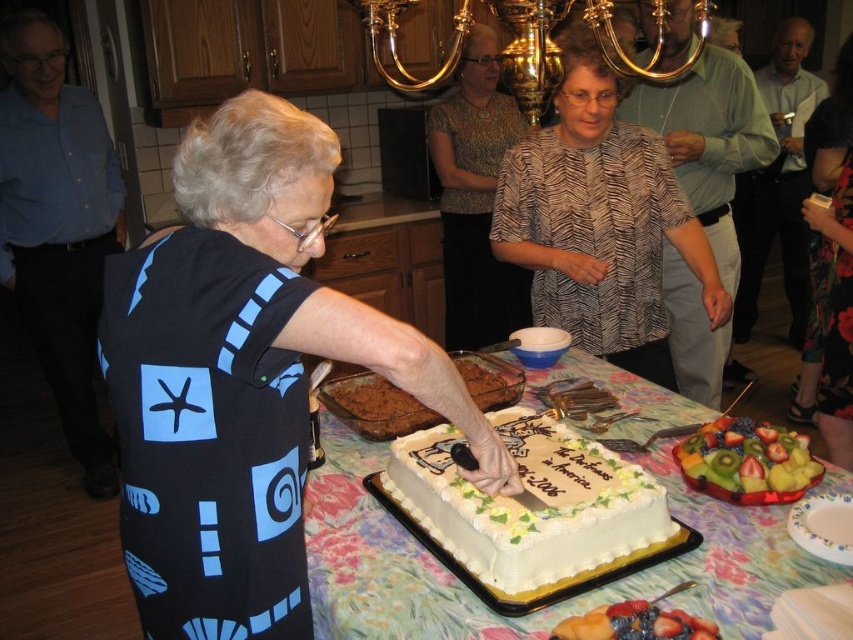
Between point (445, 612) and point (813, 536), which one is positioned behind?

Point (813, 536)

Does point (614, 582) come farther from viewer compared to point (820, 525)?

No, (614, 582) is closer to viewer.

Does point (392, 620) come behind point (817, 513)?

No, it is in front of (817, 513).

Locate an element on the screen. The image size is (853, 640). white paper plate at lower center is located at coordinates (543, 609).

Is blue printed dress at center positioned before fruity mix at lower right?

Yes, it is in front of fruity mix at lower right.

Between point (149, 400) and point (782, 456), which one is positioned in front?

Point (149, 400)

At what (x,y) coordinates should I click in order to perform the action: click on blue printed dress at center. Please return your answer as a coordinate pair (x, y). Looking at the image, I should click on (242, 376).

Between printed fabric blouse at center and white glossy plate at lower right, which one has more height?

printed fabric blouse at center

Between printed fabric blouse at center and white glossy plate at lower right, which one has less height?

white glossy plate at lower right

Measure the distance between printed fabric blouse at center and camera.

The distance of printed fabric blouse at center from camera is 5.67 feet.

The height and width of the screenshot is (640, 853). In order to click on printed fabric blouse at center in this screenshot , I will do `click(601, 221)`.